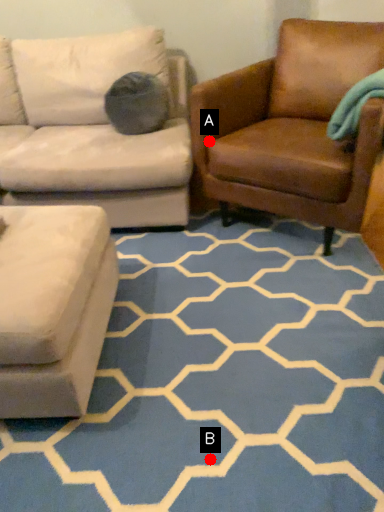
Question: Two points are circled on the image, labeled by A and B beside each circle. Which of the following is the farthest from the observer?

Choices:
 (A) A is further
 (B) B is further

Answer: (A)